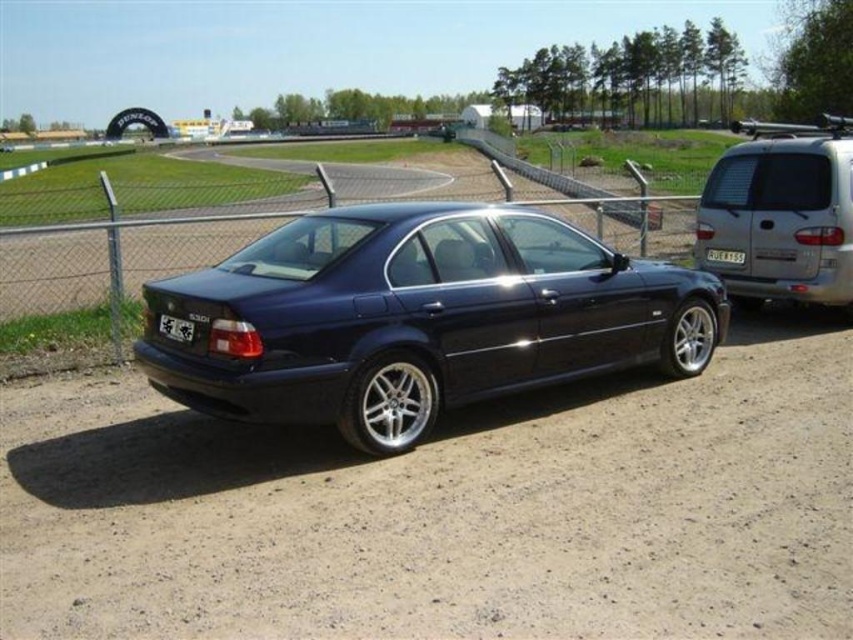
Question: Where is metallic chain-link fence at center located in relation to black plastic license plate at rear in the image?

Choices:
 (A) below
 (B) above

Answer: (B)

Question: Can you confirm if glossy dark blue sedan at center is positioned below satin silver van at right?

Choices:
 (A) no
 (B) yes

Answer: (B)

Question: Which of the following is the closest to the observer?

Choices:
 (A) (164, 332)
 (B) (90, 321)

Answer: (A)

Question: Among these points, which one is nearest to the camera?

Choices:
 (A) (779, 157)
 (B) (177, 337)
 (C) (502, 624)
 (D) (712, 253)

Answer: (C)

Question: Is dirt track at lower center in front of metallic chain-link fence at center?

Choices:
 (A) no
 (B) yes

Answer: (B)

Question: Which point is closer to the camera?

Choices:
 (A) (722, 259)
 (B) (181, 330)

Answer: (B)